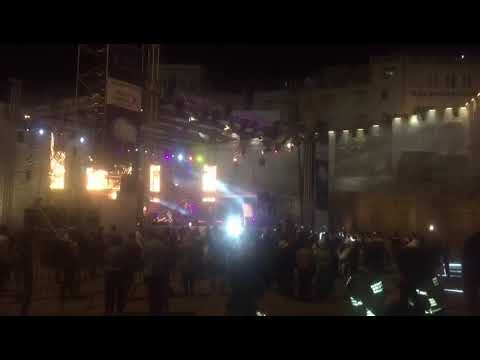
Where is `light strips`? The height and width of the screenshot is (360, 480). light strips is located at coordinates (292, 138), (203, 155).